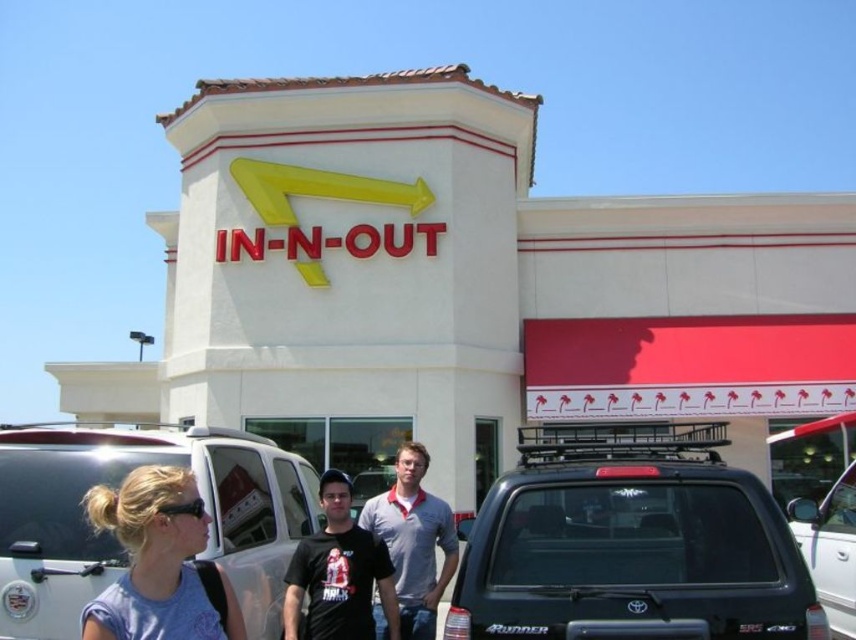
Question: Which point is farther to the camera?

Choices:
 (A) (45, 467)
 (B) (706, 444)

Answer: (B)

Question: Does gray cotton polo shirt at center appear on the right side of metallic silver truck at lower right?

Choices:
 (A) no
 (B) yes

Answer: (A)

Question: Based on their relative distances, which object is farther from the white matte building at center?

Choices:
 (A) metallic silver truck at lower right
 (B) silver metallic suv at center

Answer: (A)

Question: Does white matte building at center come in front of light purple t-shirt at lower left?

Choices:
 (A) yes
 (B) no

Answer: (B)

Question: Which object is farther from the camera taking this photo?

Choices:
 (A) silver metallic suv at center
 (B) white matte building at center
 (C) black matte suv at center
 (D) metallic silver truck at lower right

Answer: (B)

Question: Does silver metallic suv at center appear on the left side of metallic silver truck at lower right?

Choices:
 (A) no
 (B) yes

Answer: (B)